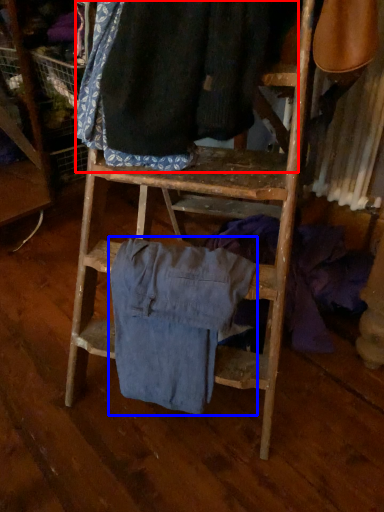
Question: Which point is further to the camera, clothing (highlighted by a red box) or clothing (highlighted by a blue box)?

Choices:
 (A) clothing
 (B) clothing

Answer: (B)